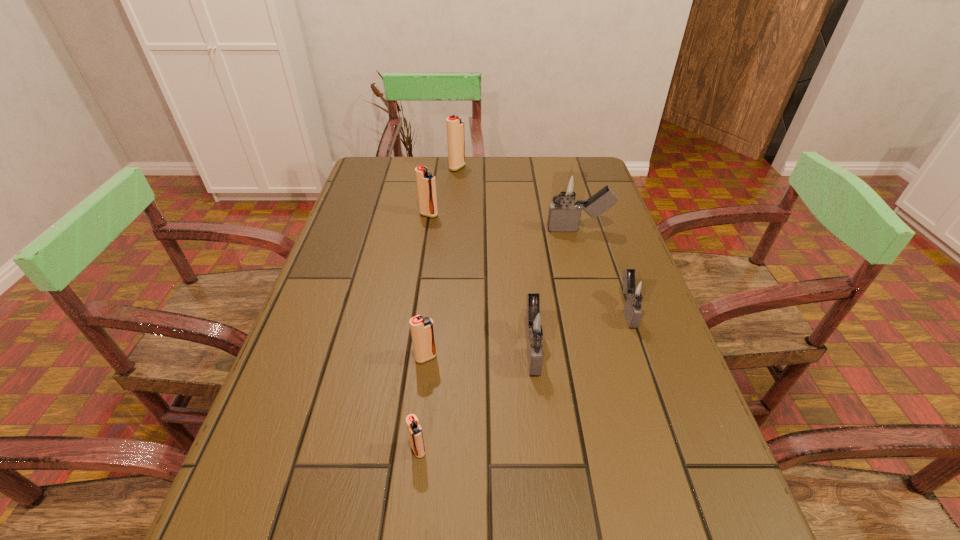
Image resolution: width=960 pixels, height=540 pixels. I want to click on the shortest object, so click(414, 430).

Where is `the nearest object`? This screenshot has height=540, width=960. the nearest object is located at coordinates (414, 430).

Identify the location of vacant space located on the right of the biggest red igniter. (585, 167).

I want to click on vacant area situated on the left of the fifth nearest object, so click(x=442, y=230).

Find the location of `blank space located 0.280m on the front of the second farthest object`. blank space located 0.280m on the front of the second farthest object is located at coordinates pyautogui.click(x=418, y=286).

Where is `vacant space located 0.340m on the left of the second biggest gray igniter`? The height and width of the screenshot is (540, 960). vacant space located 0.340m on the left of the second biggest gray igniter is located at coordinates (348, 348).

Locate an element on the screen. The width and height of the screenshot is (960, 540). blank space located 0.200m on the front of the smallest gray igniter is located at coordinates (662, 413).

In order to click on vacant point located 0.190m on the front of the second nearest red igniter in this screenshot , I will do `click(415, 457)`.

Where is `vacant area situated 0.120m on the left of the nearest red igniter`? The width and height of the screenshot is (960, 540). vacant area situated 0.120m on the left of the nearest red igniter is located at coordinates (340, 450).

Where is `object that is at the far edge`? object that is at the far edge is located at coordinates (455, 127).